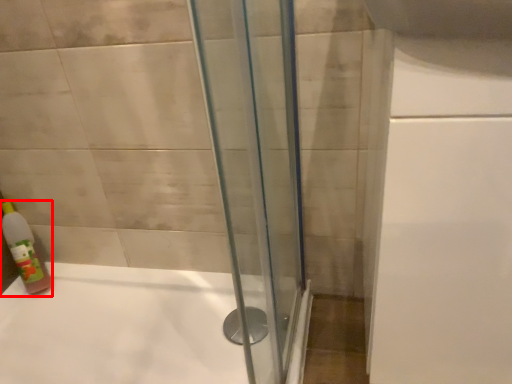
Question: From the image's perspective, where is bottle (annotated by the red box) located relative to bathtub?

Choices:
 (A) above
 (B) below

Answer: (A)